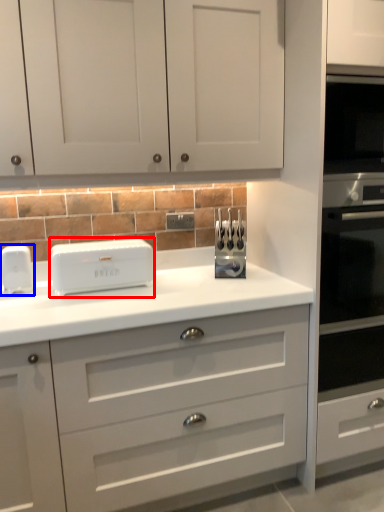
Question: Which object appears closest to the camera in this image, home appliance (highlighted by a red box) or home appliance (highlighted by a blue box)?

Choices:
 (A) home appliance
 (B) home appliance

Answer: (A)